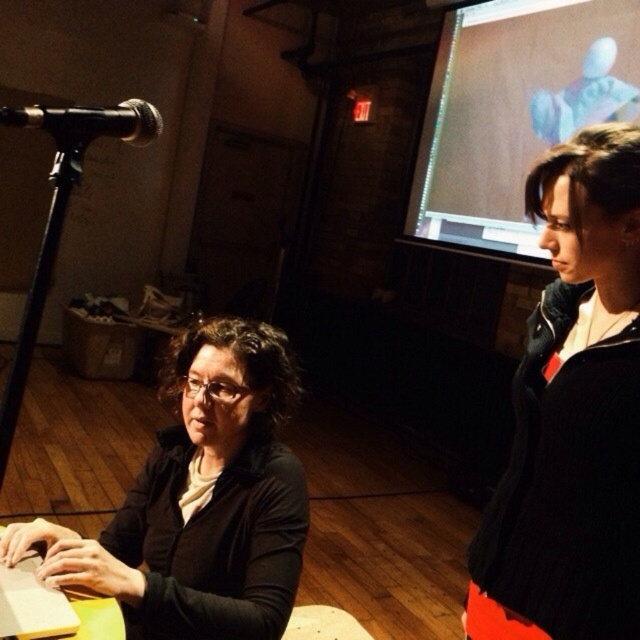
Question: Which point is closer to the camera taking this photo?

Choices:
 (A) (625, 381)
 (B) (586, 20)
 (C) (45, 115)
 (D) (29, 625)

Answer: (A)

Question: Does black knit sweater at upper right come in front of matte black sweater at lower left?

Choices:
 (A) yes
 (B) no

Answer: (A)

Question: Can you confirm if black knit sweater at upper right is positioned below matte brown screen at upper right?

Choices:
 (A) yes
 (B) no

Answer: (A)

Question: Which object is farther from the camera taking this photo?

Choices:
 (A) black knit sweater at upper right
 (B) matte brown screen at upper right

Answer: (B)

Question: Which object is farther from the camera taking this photo?

Choices:
 (A) black knit sweater at upper right
 (B) matte black sweater at lower left

Answer: (B)

Question: From the image, what is the correct spatial relationship of black knit sweater at upper right in relation to matte black sweater at lower left?

Choices:
 (A) above
 (B) below

Answer: (A)